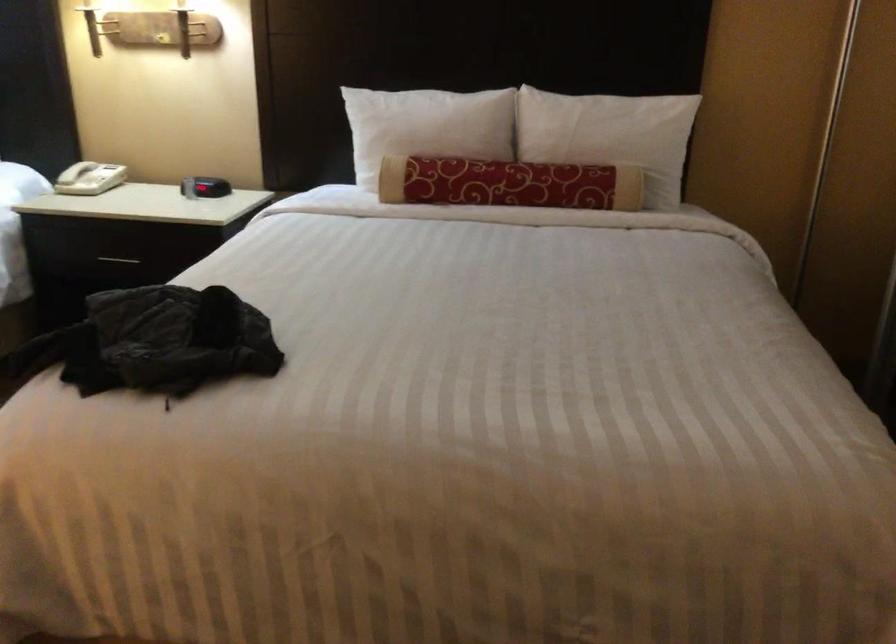
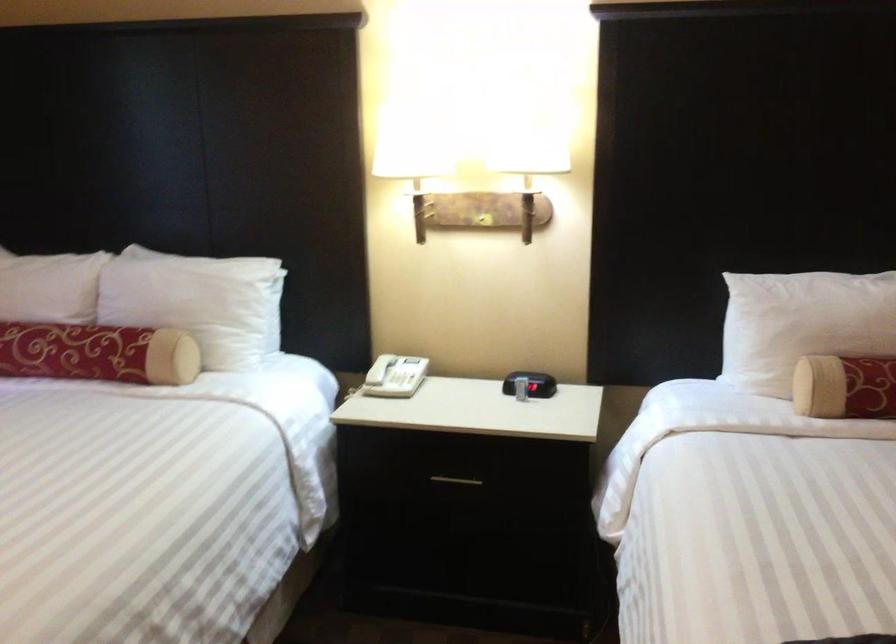
The point at [385,133] is marked in the first image. Where is the corresponding point in the second image?

(802, 324)